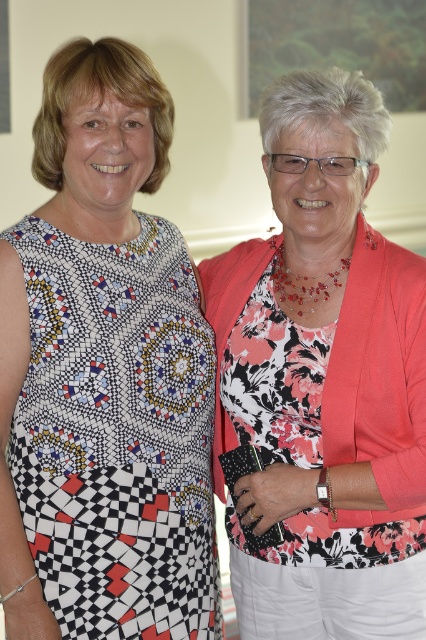
You are a photographer standing 1.5 meters away from the printed fabric dress at center. Can you reach it without moving your feet?

The printed fabric dress at center is 1.49 meters away from the viewer, so yes, you can reach it without moving your feet since it is slightly closer than your standing distance.

From the picture: You are a photographer trying to focus on the printed fabric dress at center and the floral fabric dress at right. Which dress will appear larger in the photo?

The printed fabric dress at center will appear larger in the photo because it is closer to the viewer than the floral fabric dress at right.

You are a fashion designer analyzing the image. You need to determine the exact location of the printed fabric dress at center. What are its coordinates?

The printed fabric dress at center is located at coordinates point (104, 376).